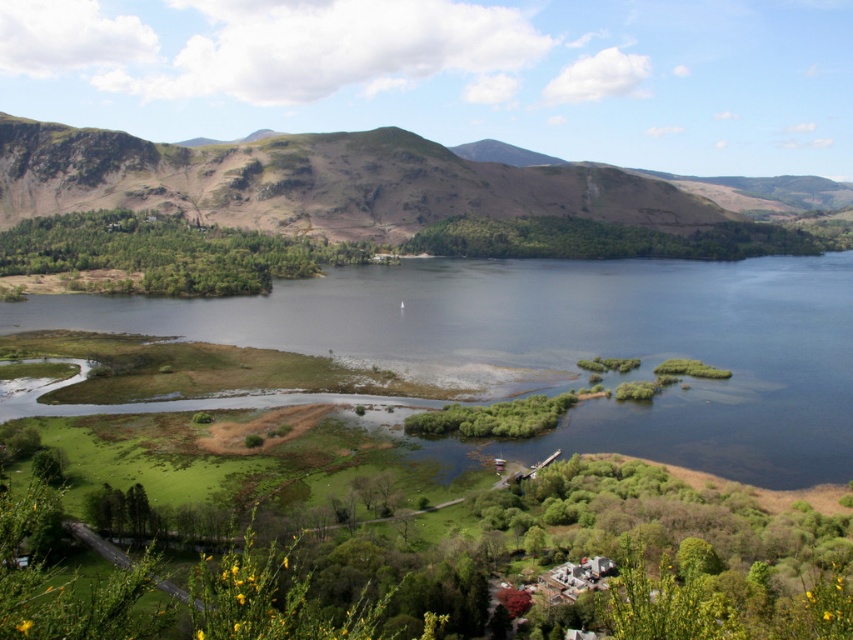
Based on the photo, does clear blue water at lower left have a lesser height compared to rugged brown mountain at center?

Yes.

Is clear blue water at lower left thinner than rugged brown mountain at center?

Correct, clear blue water at lower left's width is less than rugged brown mountain at center's.

Between point (567, 326) and point (712, 205), which one is positioned behind?

The point (712, 205) is more distant.

Where is `clear blue water at lower left`? The height and width of the screenshot is (640, 853). clear blue water at lower left is located at coordinates (566, 346).